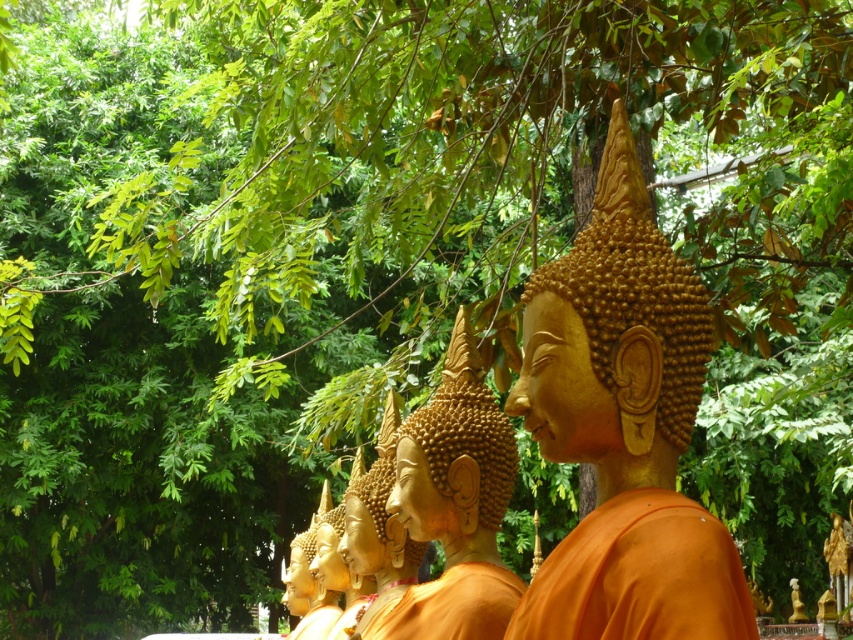
Question: Which object appears closest to the camera in this image?

Choices:
 (A) matte gold monk at center
 (B) orange matte/soft fabric at center
 (C) golden matte statue at center

Answer: (B)

Question: Can you confirm if matte gold monk at center is positioned to the right of orange matte/soft fabric at center?

Choices:
 (A) yes
 (B) no

Answer: (B)

Question: Based on their relative distances, which object is farther from the golden matte statue at center?

Choices:
 (A) matte gold monk at center
 (B) orange matte/soft fabric at center

Answer: (A)

Question: Which object appears closest to the camera in this image?

Choices:
 (A) matte gold monk at center
 (B) orange matte/soft fabric at center

Answer: (B)

Question: In this image, where is matte gold monk at center located relative to golden matte statue at center?

Choices:
 (A) below
 (B) above

Answer: (B)

Question: Does matte gold monk at center come in front of golden matte statue at center?

Choices:
 (A) yes
 (B) no

Answer: (A)